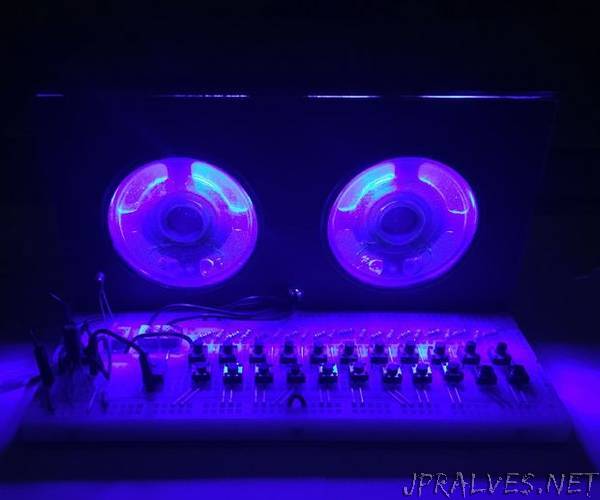
The image size is (600, 500). I want to click on background above speakers, so click(x=238, y=50).